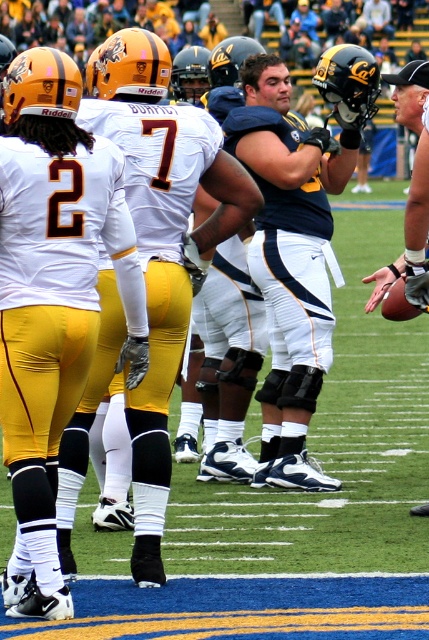
You are a photographer positioned at the center of the field. You need to take a photo that includes both the matte white jersey at left and the black matte helmet at upper right. Which object should you pan your camera towards first to ensure both are in frame?

You should pan your camera towards the matte white jersey at left first since it is positioned to the left of the black matte helmet at upper right, ensuring both are captured in the photo.

You are a photographer positioned at the center of the field. You want to take a photo that includes both the matte white jersey at left and the black matte helmet at upper right. Which object should you focus on first to ensure both are in clear view?

The matte white jersey at left is closer to the viewer than the black matte helmet at upper right. To ensure both are in clear view, focus on the matte white jersey at left first, as it is closer, and adjust the depth of field to include the black matte helmet at upper right in the background.

You are a photographer trying to capture a closeup of the matte white jersey at left and the black matte helmet at upper right. Which object should you zoom in on first to ensure it fits entirely in the frame?

The matte white jersey at left is shorter than the black matte helmet at upper right, so you should zoom in on the matte white jersey at left first to ensure it fits entirely in the frame.